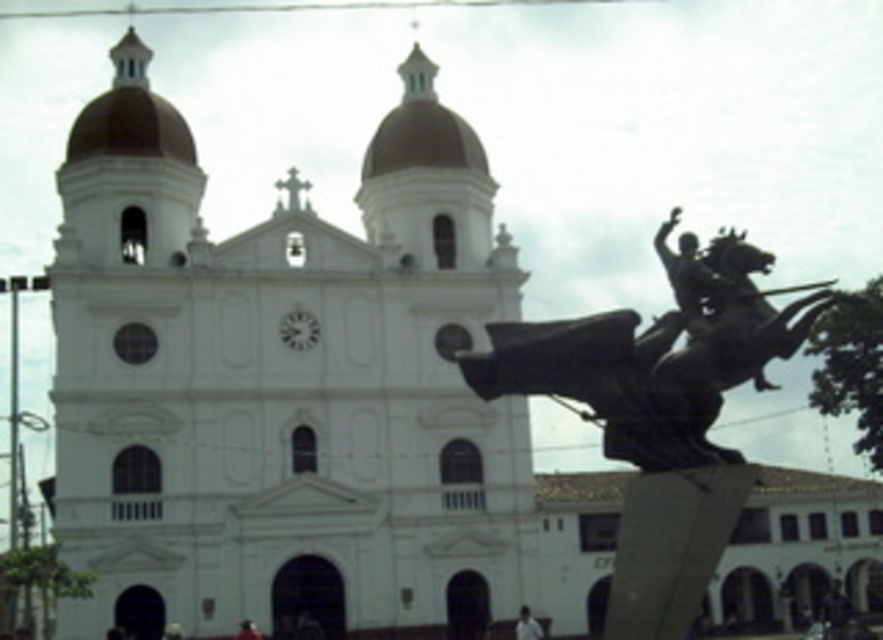
You are standing in front of the church and see the bronze statue at center and the white matte person at lower center. Which object is closer to you?

The bronze statue at center is closer to you because it is in front of the white matte person at lower center.

You are standing in front of the grand white church with two domes. You notice a bronze statue at center. Based on its 2D coordinates, where exactly is the bronze statue located in relation to the church?

The bronze statue at center is located at the coordinates point (658, 355), which places it in the lower central area of the image, closer to the bottom edge than the top, and slightly to the right of the exact center horizontally.